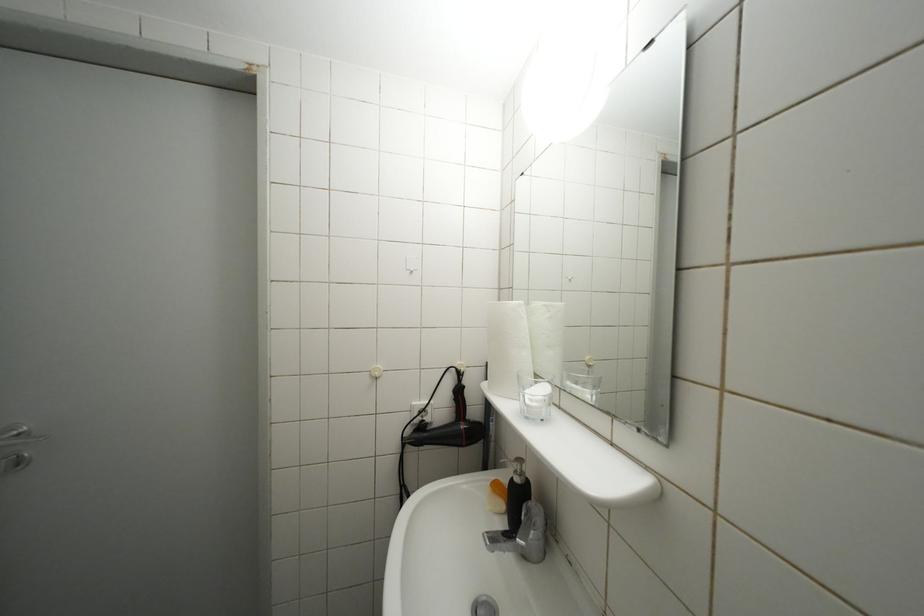
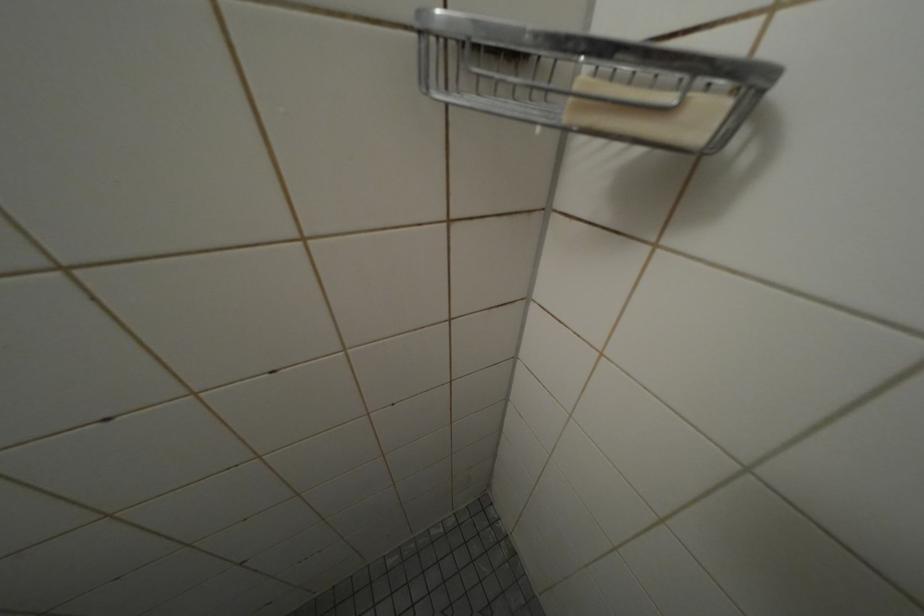
The images are taken continuously from a first-person perspective. In which direction is your viewpoint rotating?

The camera rotated toward right-down.